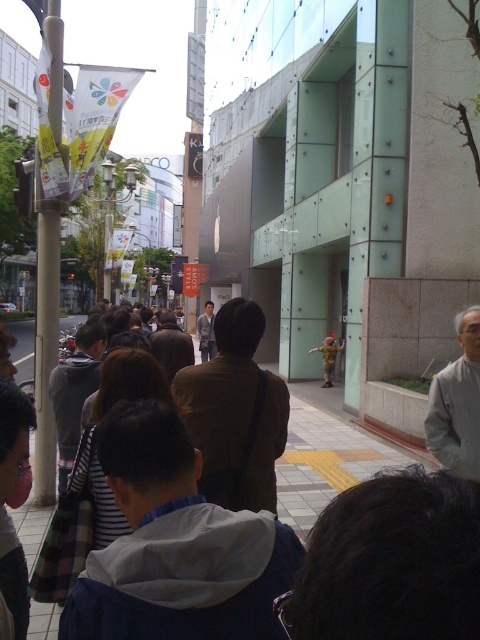
Question: Observing the image, what is the correct spatial positioning of smooth concrete pavement at center in reference to gray fabric jacket at lower right?

Choices:
 (A) left
 (B) right

Answer: (A)

Question: Which point is closer to the camera?

Choices:
 (A) (453, 442)
 (B) (324, 426)

Answer: (A)

Question: Is smooth concrete pavement at center bigger than gray fabric jacket at lower right?

Choices:
 (A) no
 (B) yes

Answer: (B)

Question: Among these points, which one is nearest to the camera?

Choices:
 (A) (323, 419)
 (B) (468, 358)

Answer: (B)

Question: Does smooth concrete pavement at center have a greater width compared to gray fabric jacket at lower right?

Choices:
 (A) no
 (B) yes

Answer: (B)